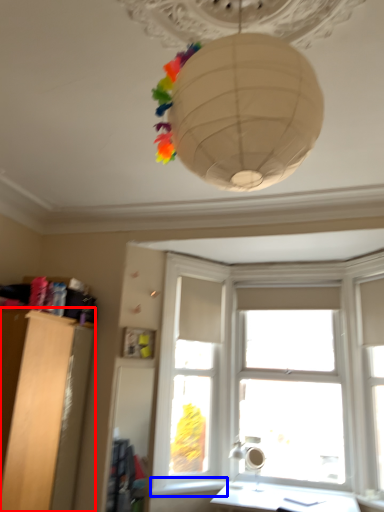
Question: Which object appears farthest to the camera in this image, furniture (highlighted by a red box) or window sill (highlighted by a blue box)?

Choices:
 (A) furniture
 (B) window sill

Answer: (B)